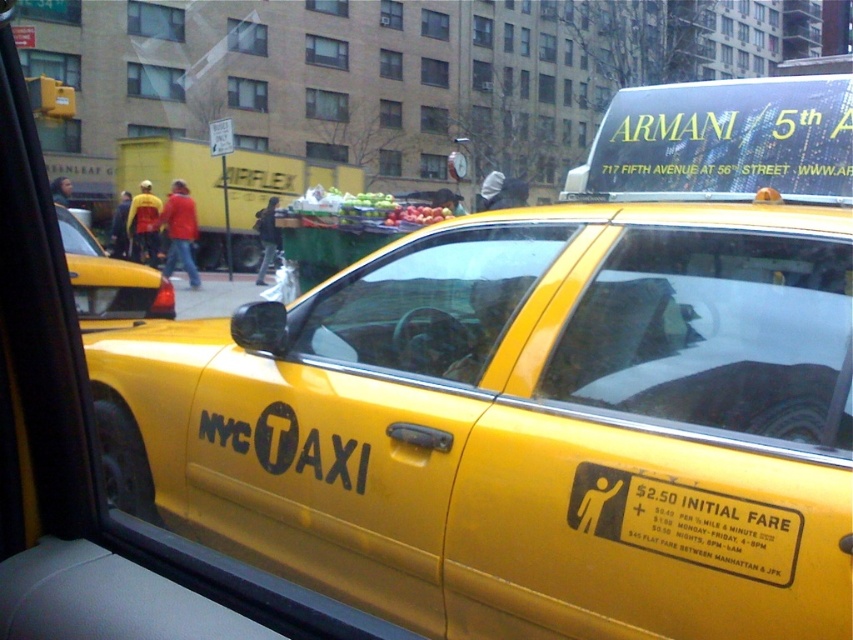
Question: Which point is farther from the camera taking this photo?

Choices:
 (A) (598, 324)
 (B) (157, 285)

Answer: (B)

Question: Is yellow matte taxi at center wider than yellow matte taxi at left?

Choices:
 (A) yes
 (B) no

Answer: (A)

Question: Does yellow matte taxi at center appear over yellow matte taxi at left?

Choices:
 (A) no
 (B) yes

Answer: (A)

Question: Which point appears closest to the camera in this image?

Choices:
 (A) (366, 493)
 (B) (144, 296)

Answer: (A)

Question: Does yellow matte taxi at center have a greater width compared to yellow matte taxi at left?

Choices:
 (A) no
 (B) yes

Answer: (B)